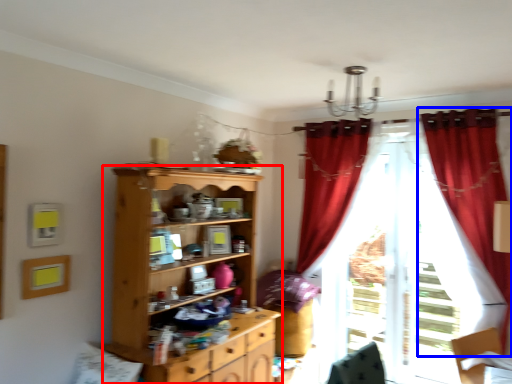
Question: Among these objects, which one is nearest to the camera, cupboard (highlighted by a red box) or curtain (highlighted by a blue box)?

Choices:
 (A) cupboard
 (B) curtain

Answer: (A)